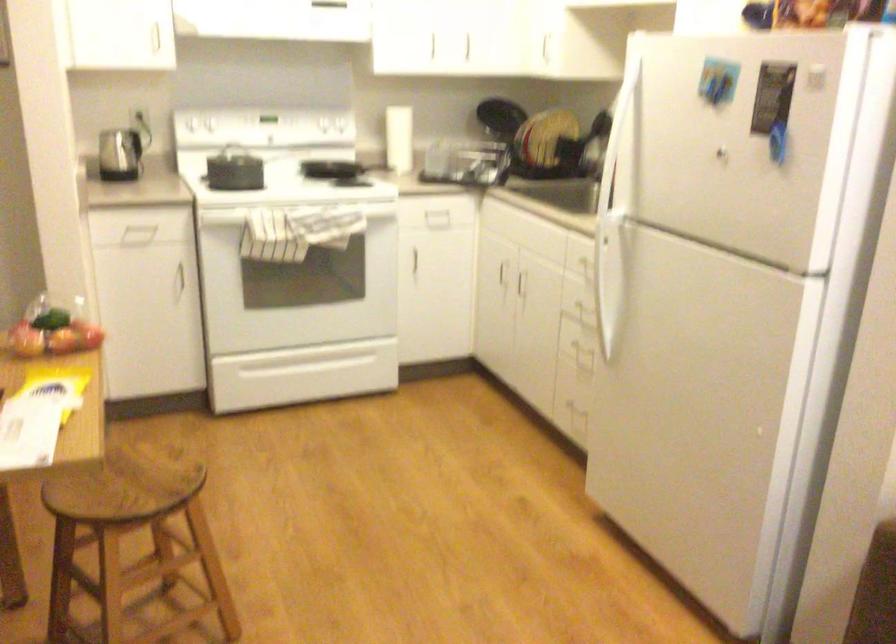
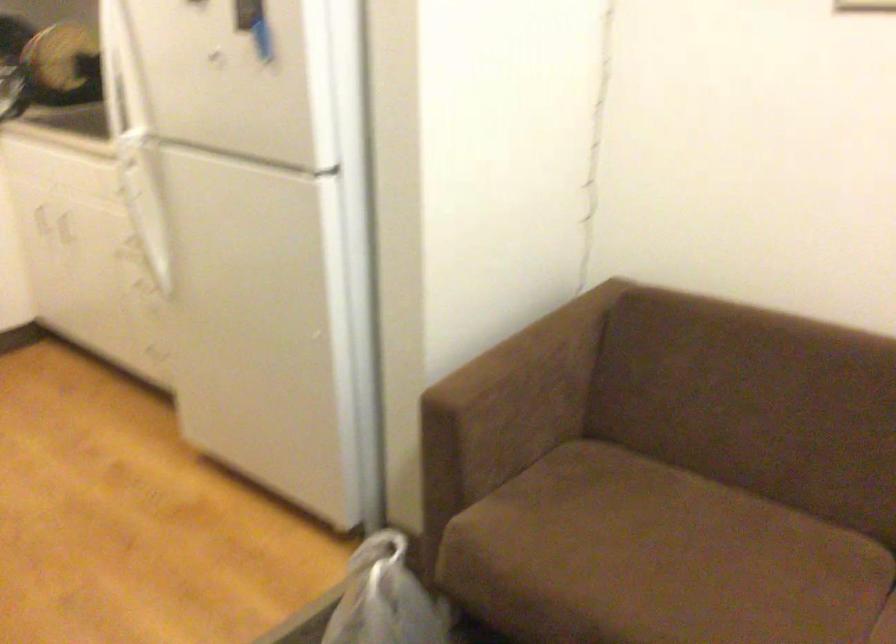
Question: Based on the continuous images, in which direction is the camera rotating? Reply with the corresponding letter.

Choices:
 (A) Left
 (B) Right
 (C) Up
 (D) Down

Answer: (B)